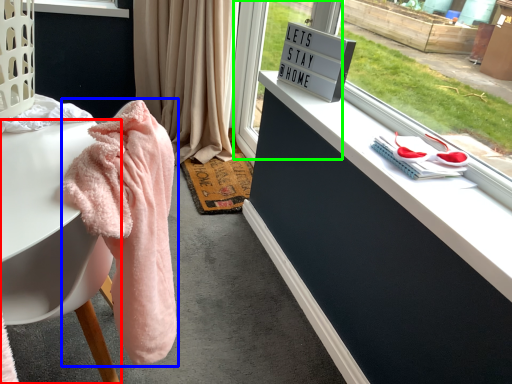
Question: Considering the real-world distances, which object is farthest from desk (highlighted by a red box)? bath towel (highlighted by a blue box) or glass door (highlighted by a green box)?

Choices:
 (A) bath towel
 (B) glass door

Answer: (B)